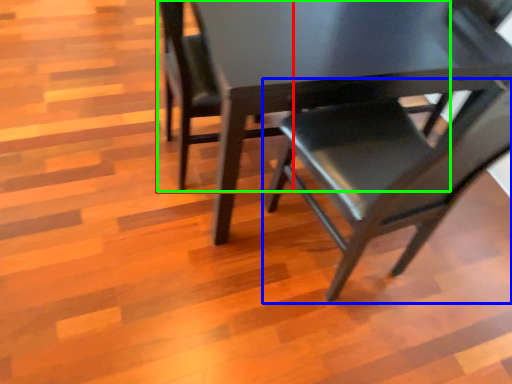
Question: Which is farther away from chair (highlighted by a red box)? chair (highlighted by a blue box) or chair (highlighted by a green box)?

Choices:
 (A) chair
 (B) chair

Answer: (A)